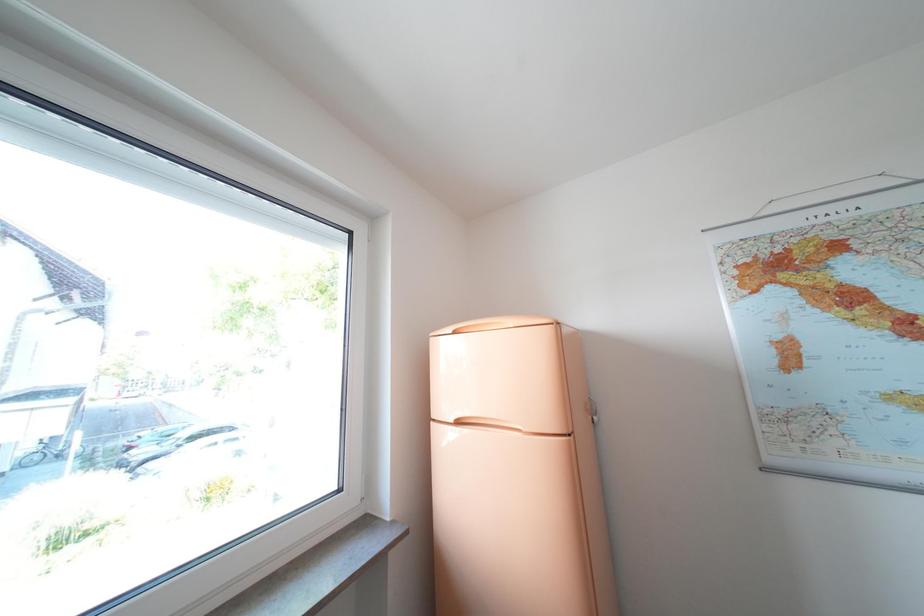
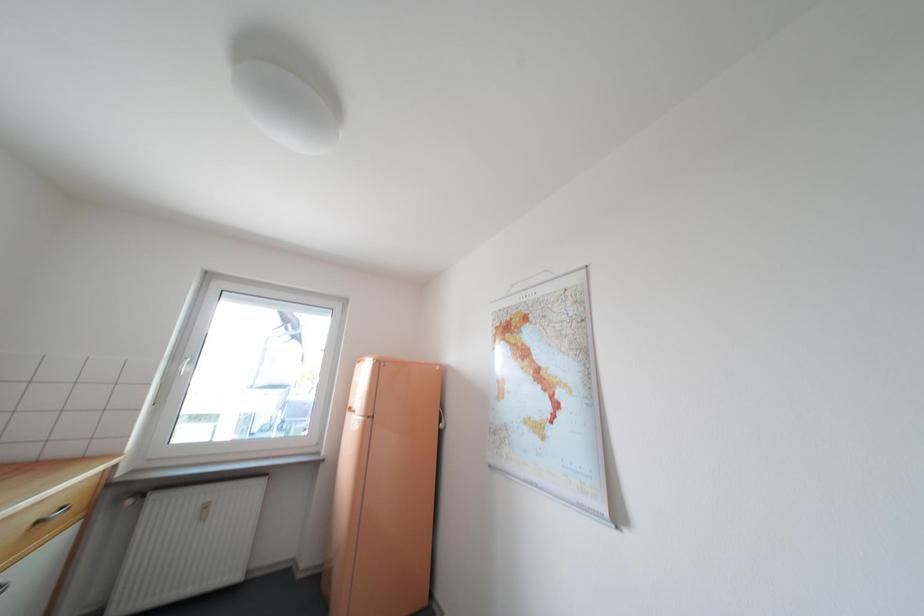
Question: The images are taken continuously from a first-person perspective. In which direction are you moving?

Choices:
 (A) Left
 (B) Right
 (C) Forward
 (D) Backward

Answer: (B)